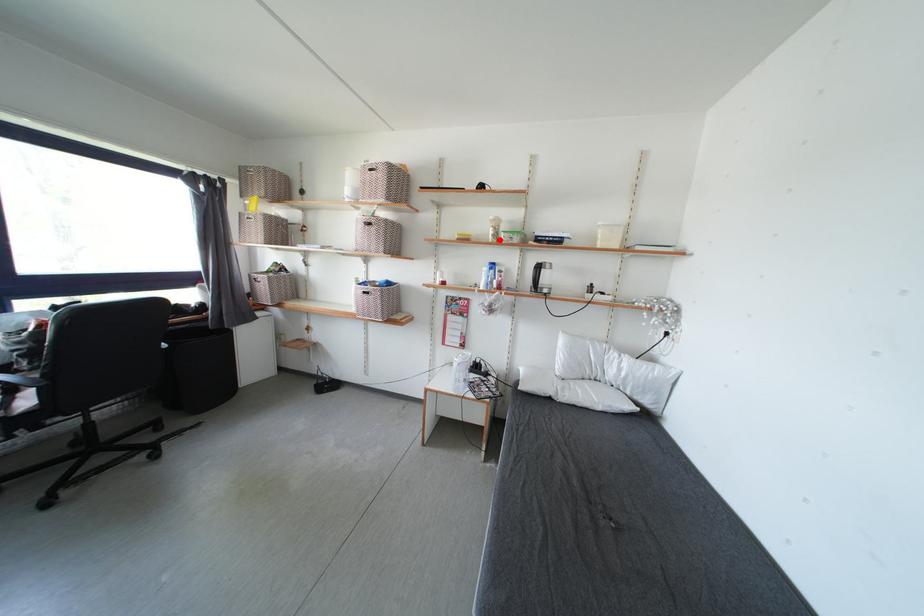
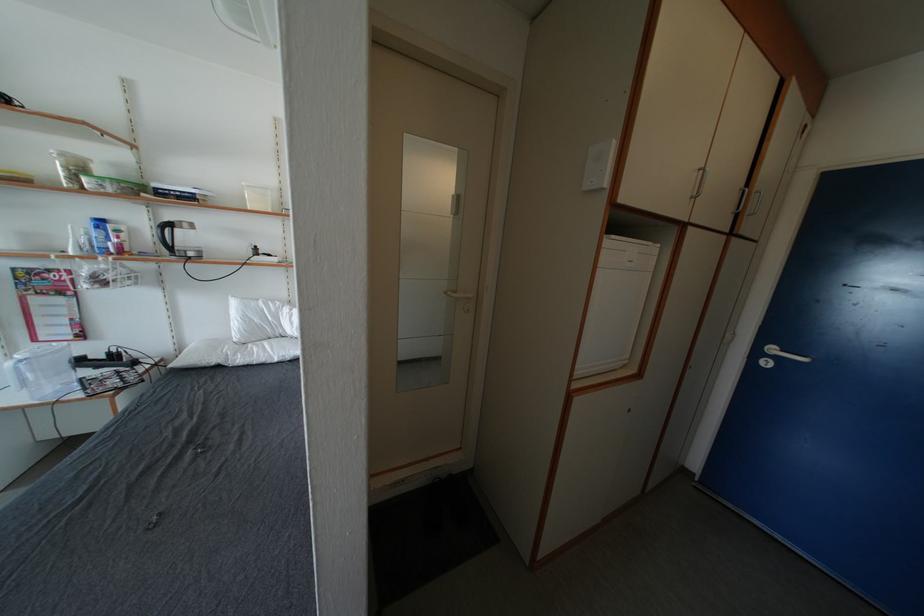
Find the pixel in the second image that matches the highlighted location in the first image.

(75, 184)